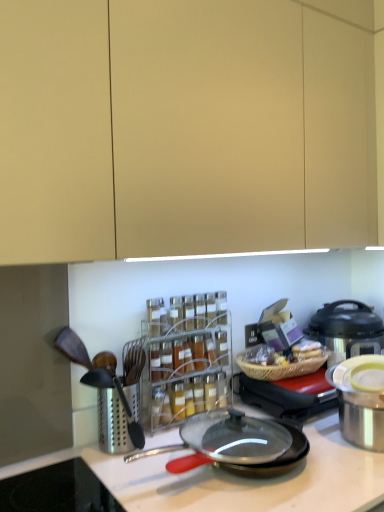
Question: Is metallic silver pressure cooker at right smaller than stainless steel pot at right, the 1th appliance positioned from the front?

Choices:
 (A) no
 (B) yes

Answer: (A)

Question: Is metallic silver pressure cooker at right positioned far away from stainless steel pot at right, the 1th appliance positioned from the front?

Choices:
 (A) no
 (B) yes

Answer: (A)

Question: Is metallic silver pressure cooker at right facing away from stainless steel pot at right, the second appliance viewed from the back?

Choices:
 (A) yes
 (B) no

Answer: (B)

Question: Can you confirm if metallic silver pressure cooker at right is positioned to the left of stainless steel pot at right, the second appliance viewed from the back?

Choices:
 (A) yes
 (B) no

Answer: (B)

Question: Does metallic silver pressure cooker at right appear on the right side of stainless steel pot at right, the 1th appliance positioned from the front?

Choices:
 (A) yes
 (B) no

Answer: (A)

Question: Considering the positions of clear plastic spice rack at center and metallic silver pressure cooker at right in the image, is clear plastic spice rack at center wider or thinner than metallic silver pressure cooker at right?

Choices:
 (A) wide
 (B) thin

Answer: (B)

Question: Considering the positions of clear plastic spice rack at center and metallic silver pressure cooker at right in the image, is clear plastic spice rack at center taller or shorter than metallic silver pressure cooker at right?

Choices:
 (A) tall
 (B) short

Answer: (A)

Question: Is clear plastic spice rack at center bigger or smaller than metallic silver pressure cooker at right?

Choices:
 (A) small
 (B) big

Answer: (A)

Question: Is clear plastic spice rack at center inside the boundaries of metallic silver pressure cooker at right, or outside?

Choices:
 (A) inside
 (B) outside

Answer: (B)

Question: In the image, is metallic silver pressure cooker at right positioned in front of or behind stainless steel pot at right, the second appliance viewed from the back?

Choices:
 (A) behind
 (B) front

Answer: (A)

Question: From the image's perspective, is metallic silver pressure cooker at right positioned above or below stainless steel pot at right, the 1th appliance positioned from the front?

Choices:
 (A) below
 (B) above

Answer: (B)

Question: Is metallic silver pressure cooker at right inside the boundaries of stainless steel pot at right, the 1th appliance positioned from the front, or outside?

Choices:
 (A) outside
 (B) inside

Answer: (A)

Question: From a real-world perspective, relative to stainless steel pot at right, the 1th appliance positioned from the front, is metallic silver pressure cooker at right vertically above or below?

Choices:
 (A) above
 (B) below

Answer: (A)

Question: In the image, is clear plastic spice rack at center positioned in front of or behind black non-stick frying pan at center?

Choices:
 (A) front
 (B) behind

Answer: (B)

Question: Considering the positions of clear plastic spice rack at center and black non-stick frying pan at center in the image, is clear plastic spice rack at center bigger or smaller than black non-stick frying pan at center?

Choices:
 (A) small
 (B) big

Answer: (B)